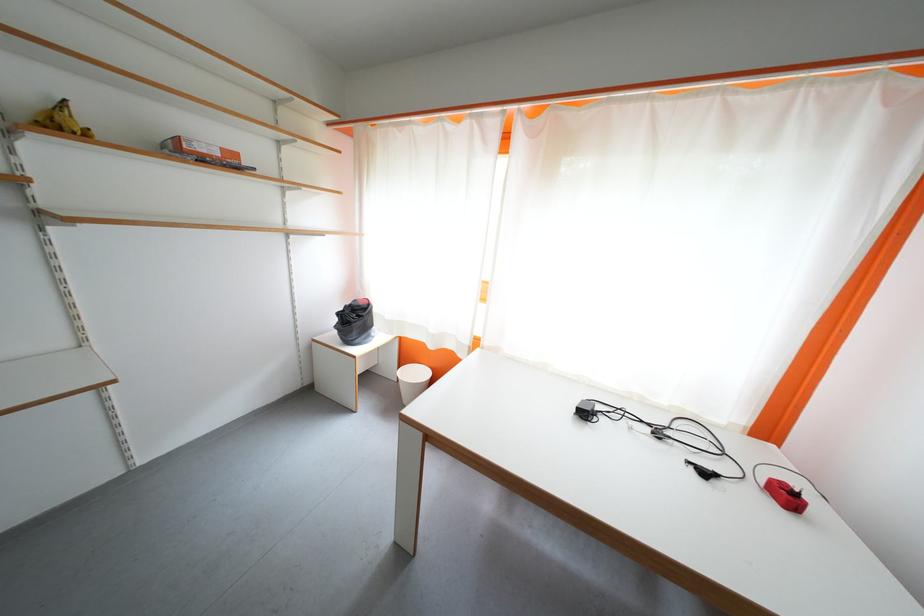
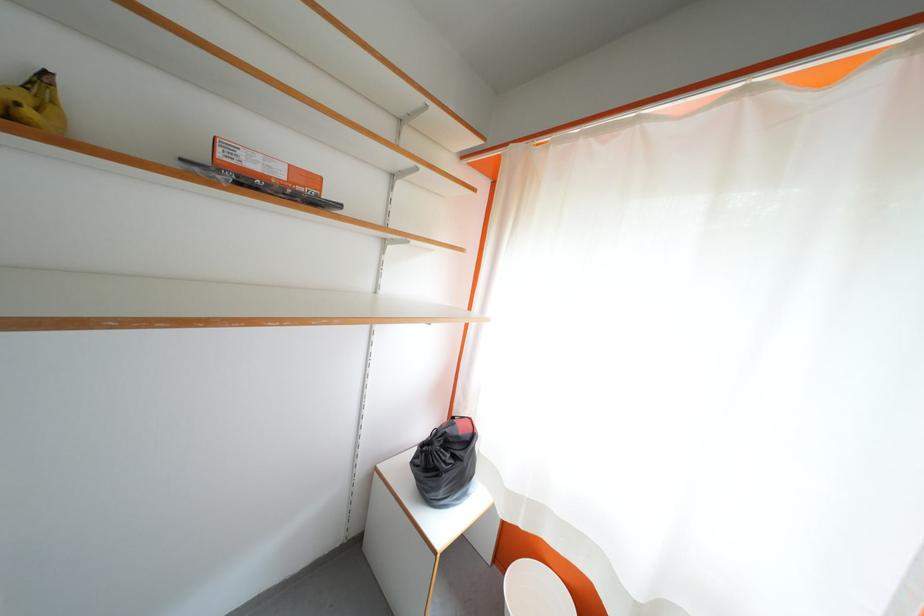
The point at (225, 156) is marked in the first image. Where is the corresponding point in the second image?

(289, 177)